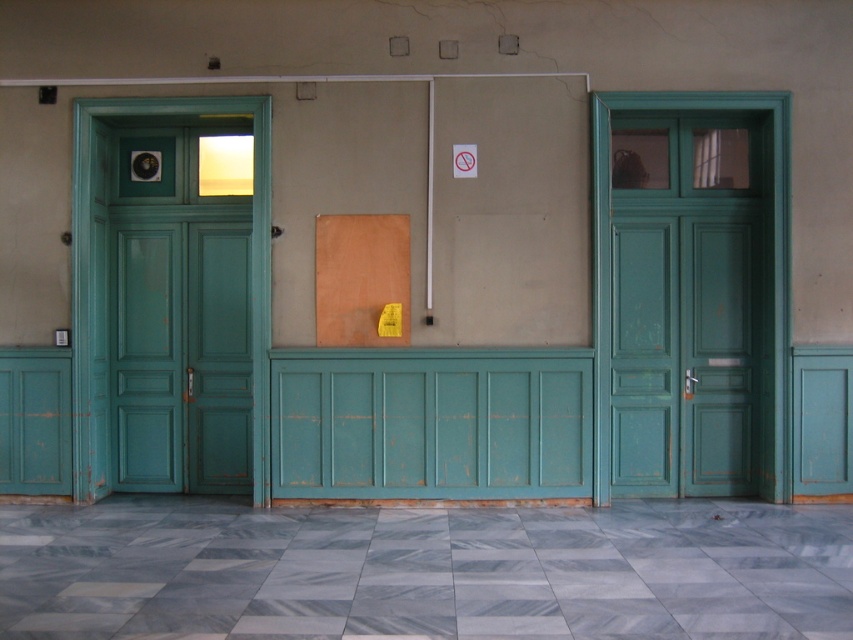
Question: Which point is farther from the camera taking this photo?

Choices:
 (A) 234,464
 (B) 728,337

Answer: (A)

Question: Can you confirm if teal wooden door at right is wider than teal wooden door at left?

Choices:
 (A) no
 (B) yes

Answer: (B)

Question: Is teal wooden door at right to the right of teal wooden door at left from the viewer's perspective?

Choices:
 (A) no
 (B) yes

Answer: (B)

Question: Which point is closer to the camera?

Choices:
 (A) (131, 340)
 (B) (782, 192)

Answer: (B)

Question: Can you confirm if teal wooden door at right is positioned to the right of teal wooden door at left?

Choices:
 (A) yes
 (B) no

Answer: (A)